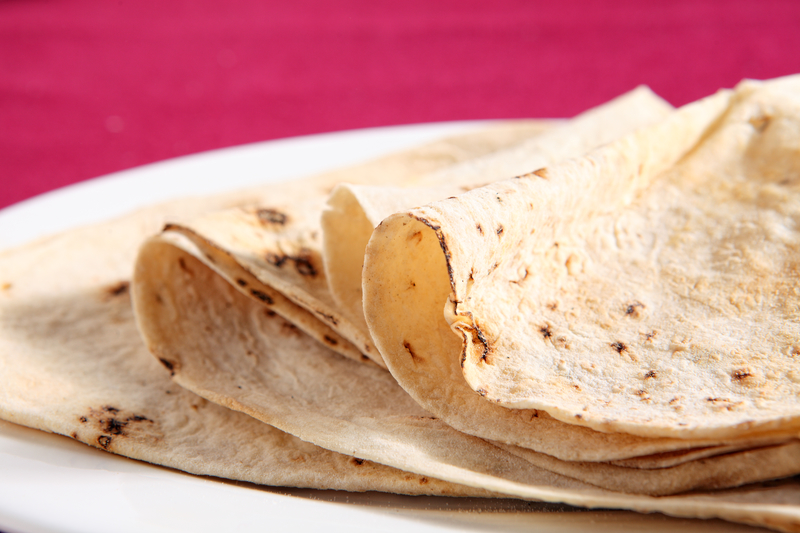
Where is `tablecloth`? The width and height of the screenshot is (800, 533). tablecloth is located at coordinates (86, 87).